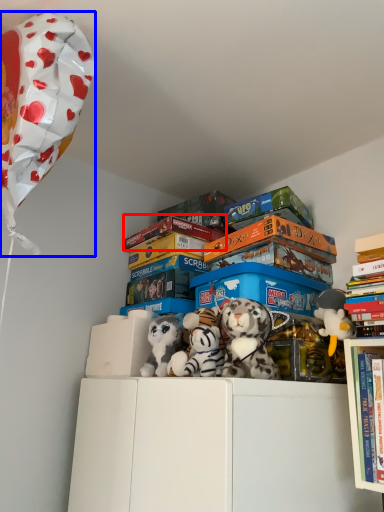
Question: Which object appears farthest to the camera in this image, book (highlighted by a red box) or balloon (highlighted by a blue box)?

Choices:
 (A) book
 (B) balloon

Answer: (A)